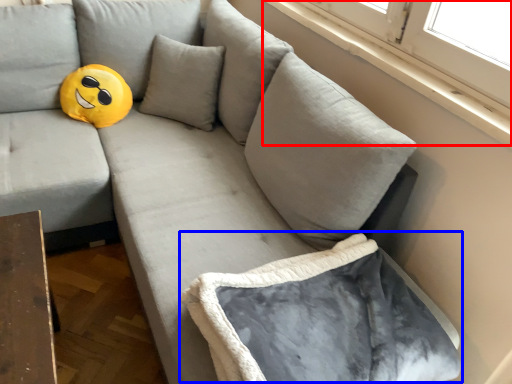
Question: Among these objects, which one is farthest to the camera, window sill (highlighted by a red box) or bean bag chair (highlighted by a blue box)?

Choices:
 (A) window sill
 (B) bean bag chair

Answer: (A)